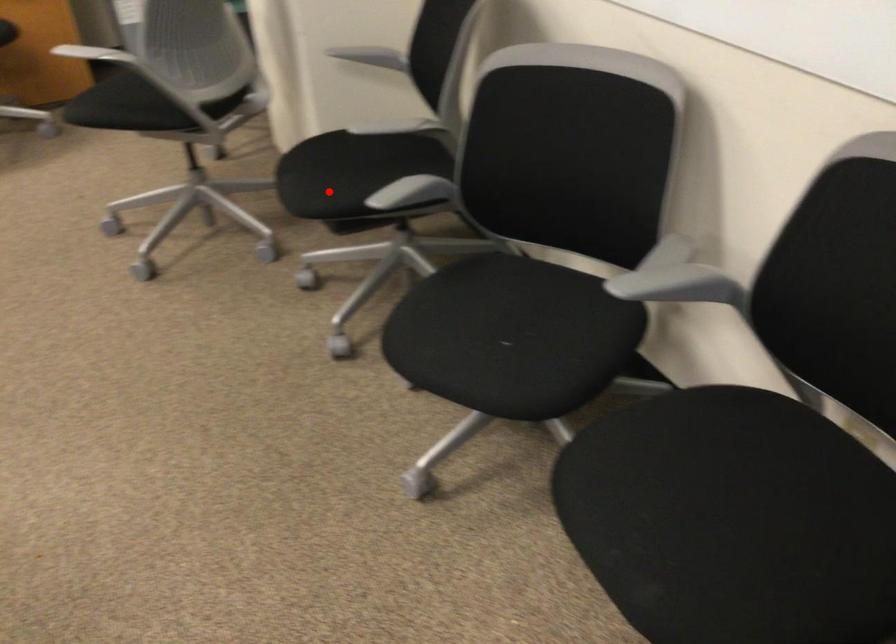
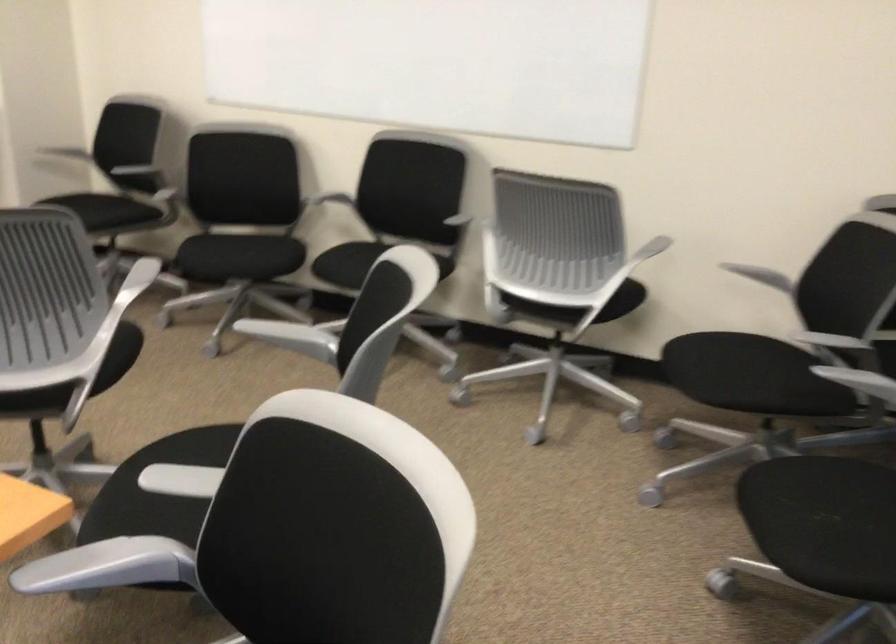
Where in the second image is the point corresponding to the highlighted location from the first image?

(97, 213)